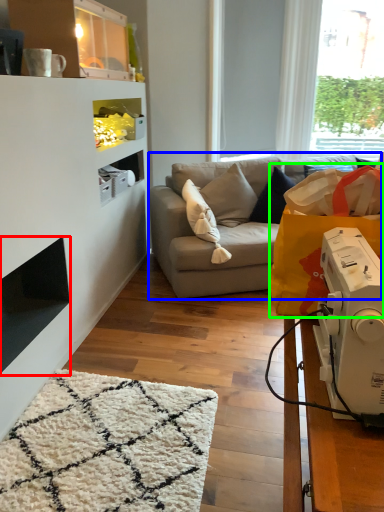
Question: Which is farther away from fireplace (highlighted by a red box)? studio couch (highlighted by a blue box) or grocery bag (highlighted by a green box)?

Choices:
 (A) studio couch
 (B) grocery bag

Answer: (B)